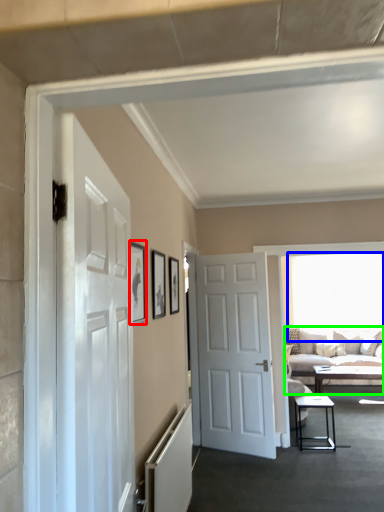
Question: Which object is the farthest from picture frame (highlighted by a red box)? Choose among these: window (highlighted by a blue box) or studio couch (highlighted by a green box).

Choices:
 (A) window
 (B) studio couch

Answer: (A)